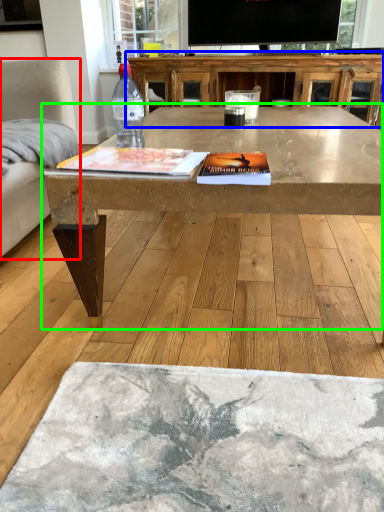
Question: Based on their relative distances, which object is nearer to armchair (highlighted by a red box)? Choose from table (highlighted by a blue box) and coffee table (highlighted by a green box).

Choices:
 (A) table
 (B) coffee table

Answer: (B)